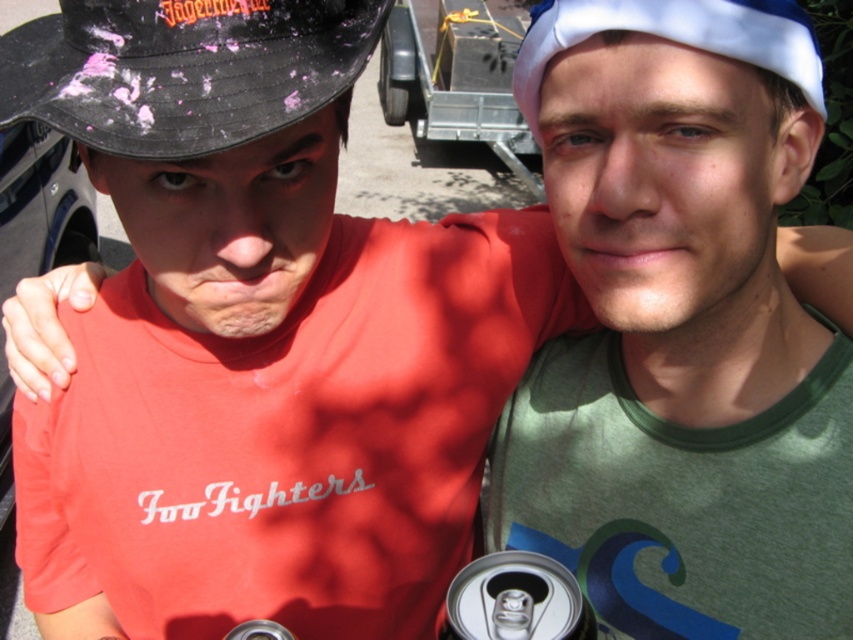
Who is higher up, silver metallic can at lower center or metallic silver can at lower center?

silver metallic can at lower center

Which of these two, silver metallic can at lower center or metallic silver can at lower center, stands taller?

Standing taller between the two is silver metallic can at lower center.

I want to click on silver metallic can at lower center, so click(515, 600).

The image size is (853, 640). I want to click on silver metallic can at lower center, so click(x=515, y=600).

Find the location of a particular element. This screenshot has height=640, width=853. black matte baseball hat at left is located at coordinates tap(183, 68).

Locate an element on the screen. The height and width of the screenshot is (640, 853). black matte baseball hat at left is located at coordinates (183, 68).

Is the position of white fabric baseball cap at upper right more distant than that of silver metallic can at lower center?

Yes, it is behind silver metallic can at lower center.

Does white fabric baseball cap at upper right appear under silver metallic can at lower center?

No.

Between point (810, 67) and point (494, 568), which one is positioned behind?

Positioned behind is point (494, 568).

Where is `white fabric baseball cap at upper right`? white fabric baseball cap at upper right is located at coordinates [x=675, y=36].